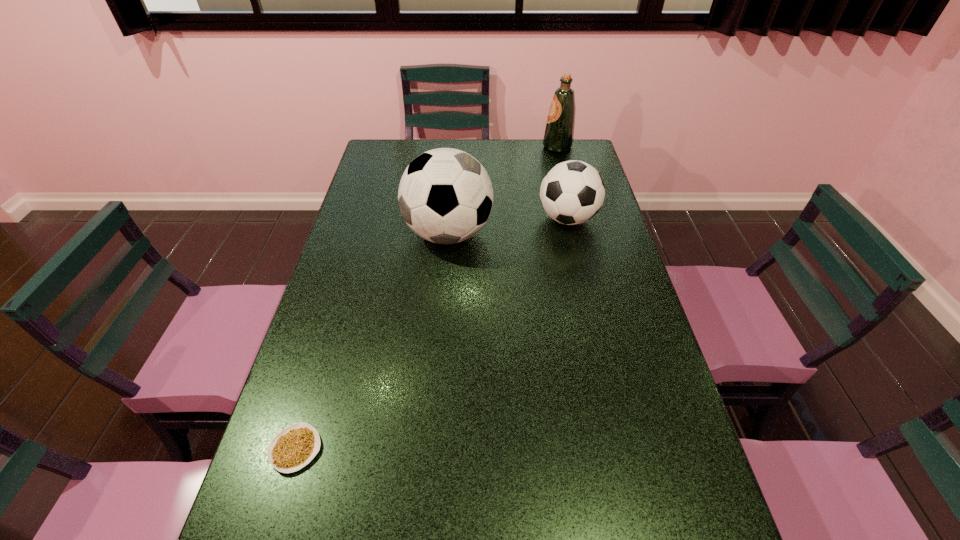
I want to click on vacant region at the right edge, so (628, 284).

In the image, there is a desktop. Find the location of `free space at the far left corner`. free space at the far left corner is located at coordinates (411, 144).

Locate an element on the screen. The width and height of the screenshot is (960, 540). empty space that is in between the third tallest object and the taller soccer ball is located at coordinates (508, 226).

Find the location of `vacant area that lies between the olive oil and the left soccer ball`. vacant area that lies between the olive oil and the left soccer ball is located at coordinates (503, 190).

What are the coordinates of `empty location between the left soccer ball and the second shortest object` in the screenshot? It's located at (508, 226).

Find the location of a particular element. This screenshot has width=960, height=540. blank region between the left soccer ball and the second shortest object is located at coordinates (508, 226).

Locate an element on the screen. The height and width of the screenshot is (540, 960). unoccupied area between the taller soccer ball and the nearest object is located at coordinates (372, 341).

Where is `free space between the nearest object and the olive oil`? This screenshot has height=540, width=960. free space between the nearest object and the olive oil is located at coordinates (426, 298).

I want to click on vacant space that's between the right soccer ball and the third object from right to left, so click(x=508, y=226).

Identify which object is located as the third nearest to the taller soccer ball. Please provide its 2D coordinates. Your answer should be formatted as a tuple, i.e. [(x, y)], where the tuple contains the x and y coordinates of a point satisfying the conditions above.

[(294, 447)]